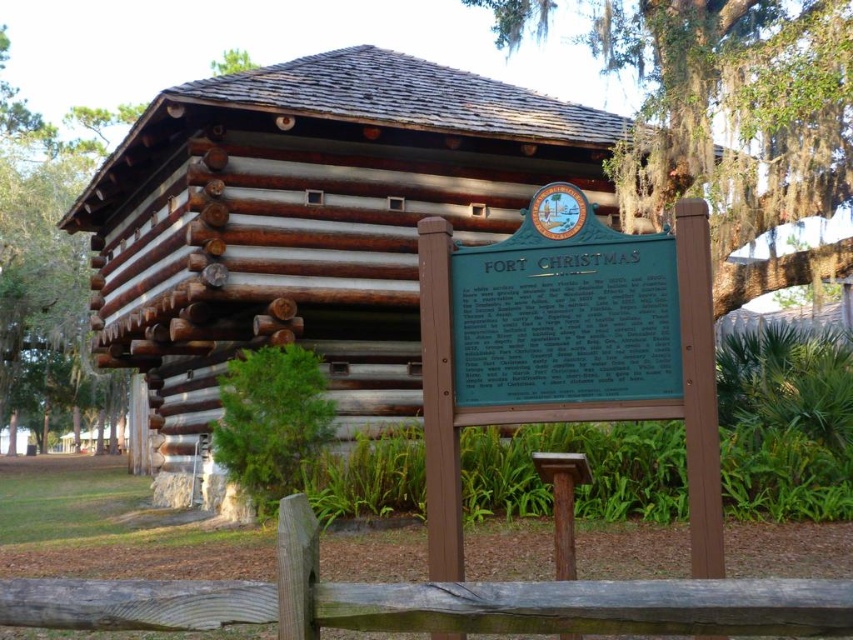
You are standing at the entrance of Fort Christmas and want to take a photo of the green mossy tree at upper right. According to the coordinates provided, where should you position yourself to capture the tree in your shot?

The green mossy tree at upper right is located at point (740, 122), so you should position yourself to aim your camera towards that coordinate to capture it in your photo.

You are a visitor at the historical site and want to take a photo of the green metal sign at center. However, you notice a weathered wood fence at lower center in the way. Can you walk around the fence to get a clear shot of the sign?

The weathered wood fence at lower center is not as tall as green metal sign at center, so yes, you can walk around the fence to get a clear shot of the sign since the sign is taller and more visible from the sides.

Consider the image. You are a visitor at Fort Christmas and want to read the green plaque at center. Where should you look to find it?

The green plaque at center is located at point 0.542 on the x axis and 0.666 on the y axis.